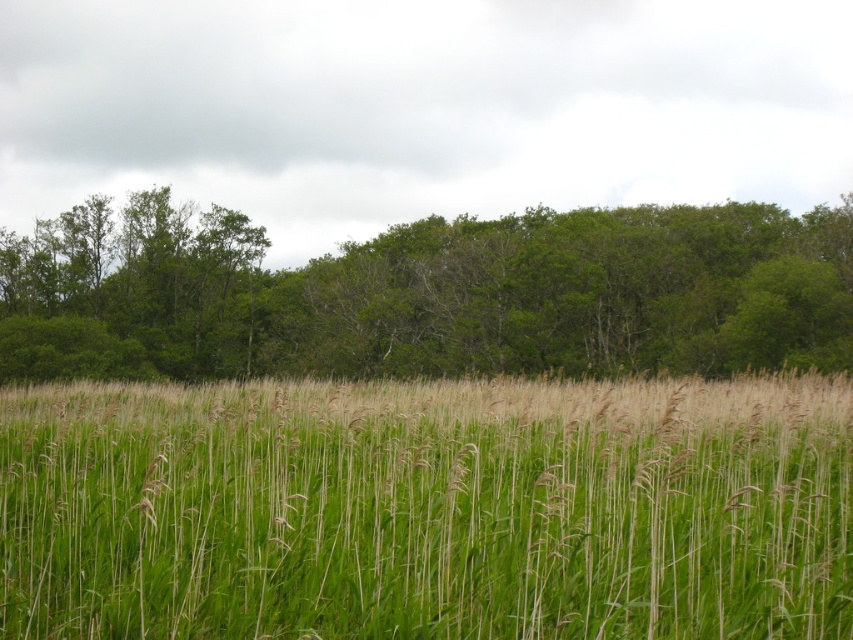
You are standing in the field of green grass at center and want to walk towards the green leafy trees at upper center. Which direction should you move?

You should move to the left because the green grass at center is to the right of the green leafy trees at upper center, so moving left will take you towards them.

You are standing in the middle of the field and want to walk towards the green grass at center. Which direction should you walk?

Since the green grass at center is located at point (427, 509), you should walk forward to reach it because it is directly ahead in the center of the field.

You are standing in the field of green grass at center and want to walk towards the green leafy trees at upper center. Which direction should you walk to reach them?

You should walk forward towards the green leafy trees at upper center because they are located in the upper part of the scene, which is typically the direction you face when moving forward in an image.